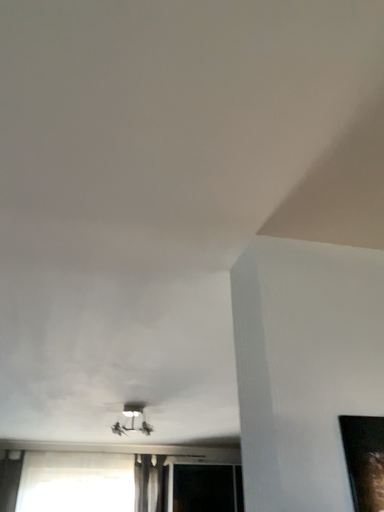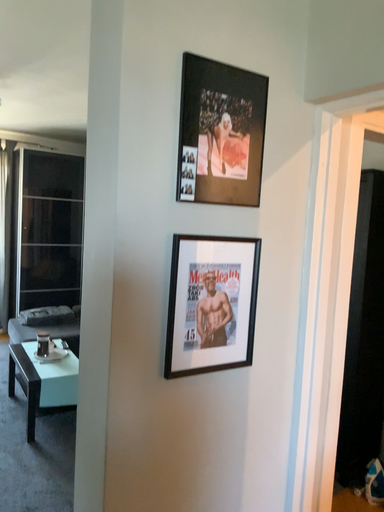
Question: Which way did the camera rotate in the video?

Choices:
 (A) rotated right
 (B) rotated left

Answer: (A)